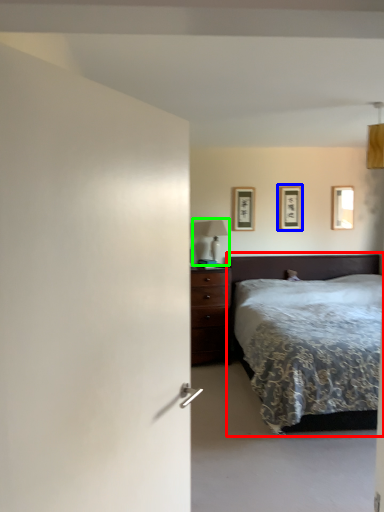
Question: Which object is positioned closest to bed (highlighted by a red box)? Select from picture frame (highlighted by a blue box) and table lamp (highlighted by a green box).

Choices:
 (A) picture frame
 (B) table lamp

Answer: (A)